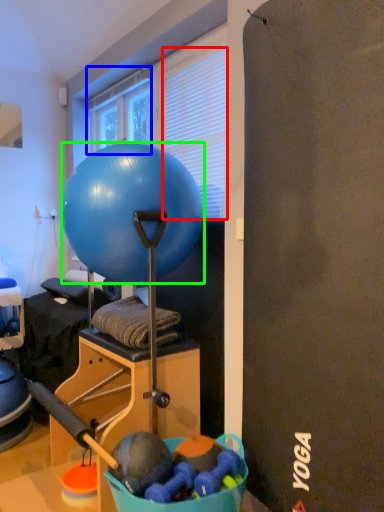
Question: Which object is positioned farthest from blind (highlighted by a red box)? Select from window (highlighted by a blue box) and ball (highlighted by a green box).

Choices:
 (A) window
 (B) ball

Answer: (A)